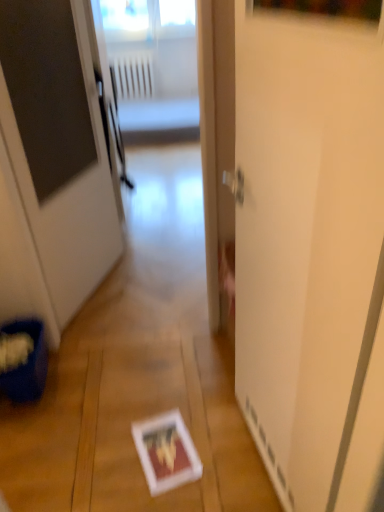
Question: From the image's perspective, is white glossy screen door at center below white glossy door at center?

Choices:
 (A) yes
 (B) no

Answer: (A)

Question: Can you confirm if white glossy screen door at center is thinner than white glossy door at center?

Choices:
 (A) yes
 (B) no

Answer: (A)

Question: Is white glossy screen door at center oriented away from white glossy door at center?

Choices:
 (A) yes
 (B) no

Answer: (B)

Question: Is white glossy screen door at center bigger than white glossy door at center?

Choices:
 (A) no
 (B) yes

Answer: (A)

Question: Is the depth of white glossy screen door at center greater than that of white glossy door at center?

Choices:
 (A) no
 (B) yes

Answer: (A)

Question: In the image, is white glossy door at center on the left side or the right side of white glossy screen door at center?

Choices:
 (A) left
 (B) right

Answer: (A)

Question: Choose the correct answer: Is white glossy door at center inside white glossy screen door at center or outside it?

Choices:
 (A) outside
 (B) inside

Answer: (A)

Question: Looking at their shapes, would you say white glossy door at center is wider or thinner than white glossy screen door at center?

Choices:
 (A) thin
 (B) wide

Answer: (B)

Question: From the image's perspective, is white glossy door at center located above or below white glossy screen door at center?

Choices:
 (A) below
 (B) above

Answer: (B)

Question: From the image's perspective, is white glossy screen door at center located above or below white glossy door at center?

Choices:
 (A) below
 (B) above

Answer: (A)

Question: Do you think white glossy screen door at center is within white glossy door at center, or outside of it?

Choices:
 (A) inside
 (B) outside

Answer: (B)

Question: Is white glossy screen door at center to the left or to the right of white glossy door at center in the image?

Choices:
 (A) left
 (B) right

Answer: (B)

Question: Is white glossy screen door at center wider or thinner than white glossy door at center?

Choices:
 (A) wide
 (B) thin

Answer: (B)

Question: Is point (140, 97) closer or farther from the camera than point (289, 125)?

Choices:
 (A) closer
 (B) farther

Answer: (B)

Question: From a real-world perspective, is white plastic radiator at upper center above or below white glossy screen door at center?

Choices:
 (A) below
 (B) above

Answer: (A)